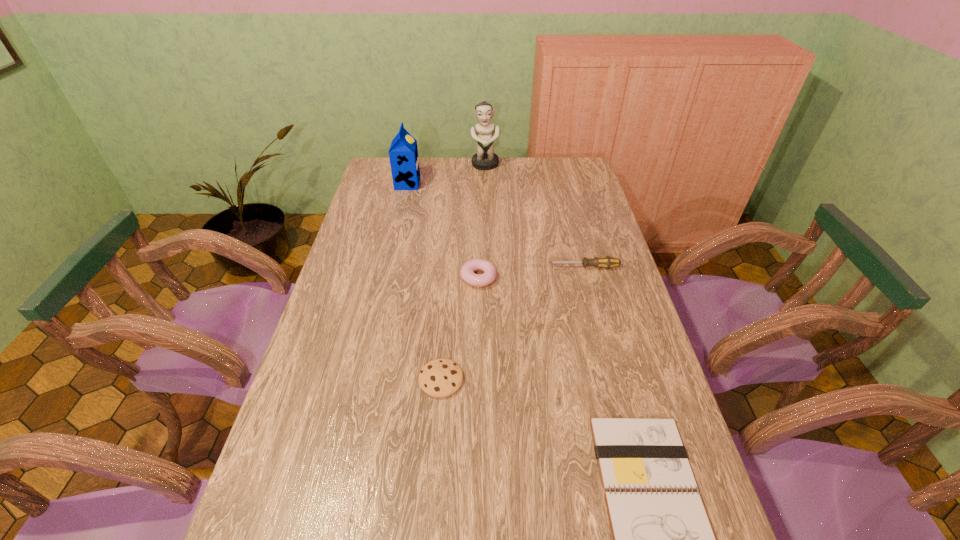
Where is `free spot that satisfies the following two spatial constraints: 1. with the cap open on the fifth farthest object; 2. on the right side of the second farthest object`? This screenshot has width=960, height=540. free spot that satisfies the following two spatial constraints: 1. with the cap open on the fifth farthest object; 2. on the right side of the second farthest object is located at coordinates (363, 380).

You are a GUI agent. You are given a task and a screenshot of the screen. Output one action in this format:
    pyautogui.click(x=<x>, y=<y>)
    Task: Click on the free region that satisfies the following two spatial constraints: 1. with the cap open on the second farthest object; 2. on the right side of the cookie
    
    Given the screenshot: What is the action you would take?
    pyautogui.click(x=363, y=380)

Locate an element on the screen. vacant space that satisfies the following two spatial constraints: 1. with the cap open on the leftmost object; 2. on the right side of the fifth farthest object is located at coordinates (363, 380).